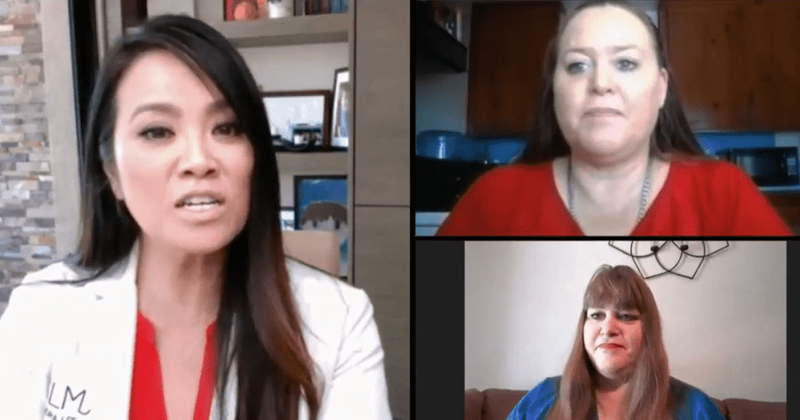
Where is `brown couch`? The width and height of the screenshot is (800, 420). brown couch is located at coordinates (740, 408).